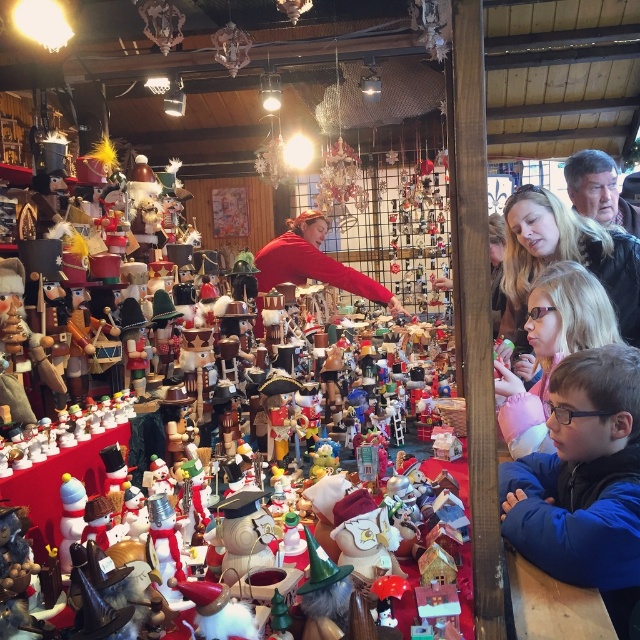
Does blue fleece jacket at lower right have a lesser height compared to matte black hair at upper right?

In fact, blue fleece jacket at lower right may be taller than matte black hair at upper right.

Does blue fleece jacket at lower right have a greater width compared to matte black hair at upper right?

Incorrect, blue fleece jacket at lower right's width does not surpass matte black hair at upper right's.

You are a GUI agent. You are given a task and a screenshot of the screen. Output one action in this format:
    pyautogui.click(x=<x>, y=<y>)
    Task: Click on the blue fleece jacket at lower right
    The image size is (640, 640).
    Given the screenshot: What is the action you would take?
    pyautogui.click(x=582, y=481)

Can you confirm if blue fleece jacket at lower right is wider than blonde hair at upper right?

Incorrect, blue fleece jacket at lower right's width does not surpass blonde hair at upper right's.

You are a GUI agent. You are given a task and a screenshot of the screen. Output one action in this format:
    pyautogui.click(x=<x>, y=<y>)
    Task: Click on the blue fleece jacket at lower right
    
    Given the screenshot: What is the action you would take?
    pyautogui.click(x=582, y=481)

Is blue fleece jacket at lower right taller than red matte sweater at center?

No.

Is blue fleece jacket at lower right positioned in front of red matte sweater at center?

Yes, blue fleece jacket at lower right is in front of red matte sweater at center.

What do you see at coordinates (582, 481) in the screenshot?
I see `blue fleece jacket at lower right` at bounding box center [582, 481].

The width and height of the screenshot is (640, 640). Identify the location of blue fleece jacket at lower right. (582, 481).